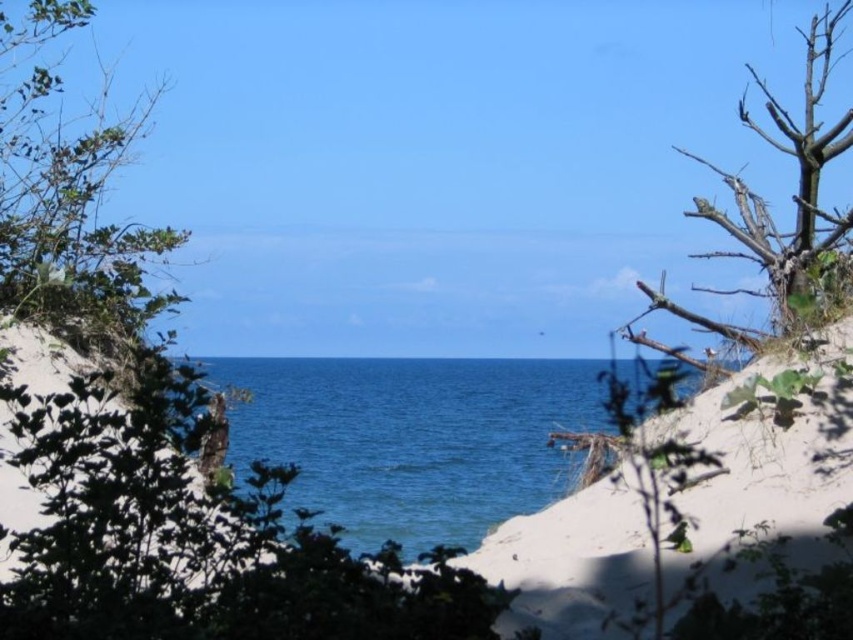
You are standing at the center of the sand dunes in the coastal scene. You see a point labeled as point (67, 198). What does this point represent?

The point (67, 198) represents the green leafy tree at left.

You are standing on the beach and see the blue water at center and the brown rough tree at right. Which object is farther away from you?

The brown rough tree at right is farther away because it is positioned behind the blue water at center.

You are standing on the sand dunes and want to cross to the other side. You see the blue water at center and the brown rough tree at right. Which path would allow you to cross without getting wet?

The path near the brown rough tree at right is better because the blue water at center might be wider than the brown rough tree at right, so crossing there could lead to getting wet.